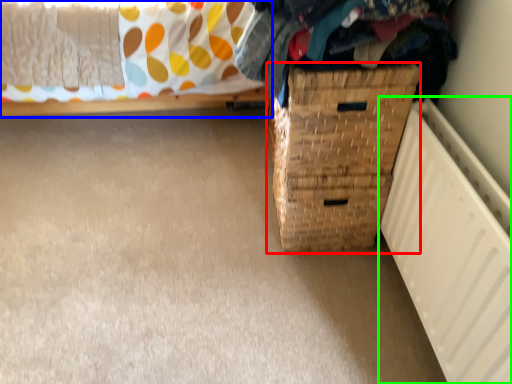
Question: Estimate the real-world distances between objects in this image. Which object is farther from basket container (highlighted by a red box), furniture (highlighted by a blue box) or radiator (highlighted by a green box)?

Choices:
 (A) furniture
 (B) radiator

Answer: (A)